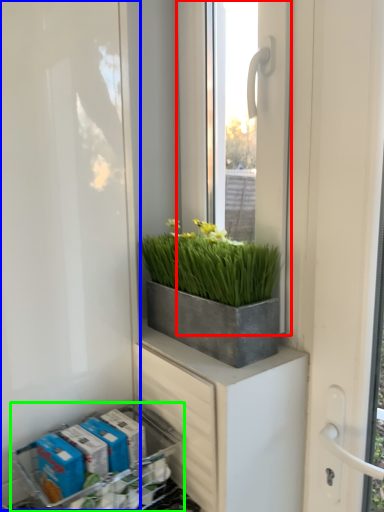
Question: Based on their relative distances, which object is farther from window (highlighted by a red box)? Choose from screen door (highlighted by a blue box) and flower box (highlighted by a green box).

Choices:
 (A) screen door
 (B) flower box

Answer: (B)